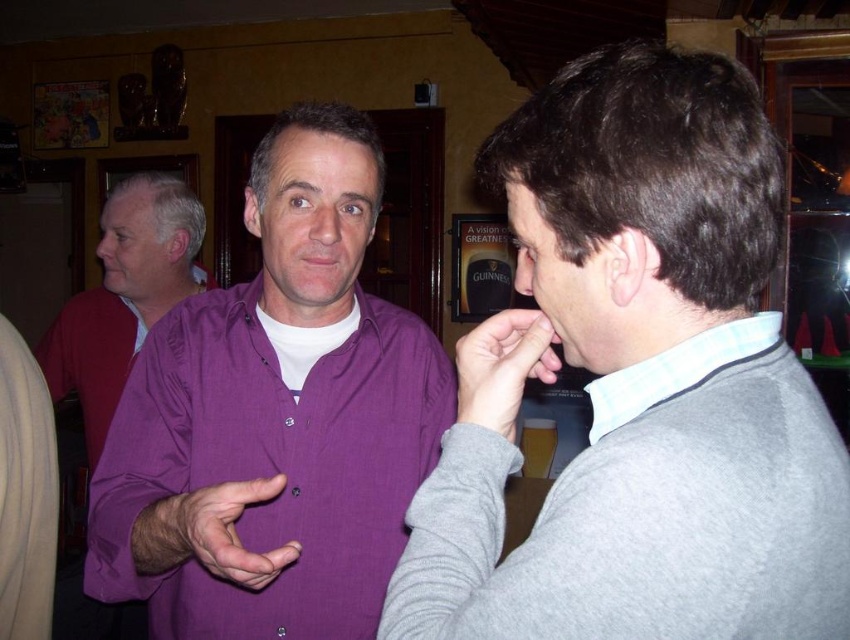
You are a photographer standing in the pub scene. You want to take a closeup photo of the purple cotton shirt at center without getting too close. Considering the distance between you and the shirt, what is the minimum focal length lens you should use if your camera sensor is 36mm wide?

The minimum focal length lens required would be calculated using the formula focal length equals sensor width multiplied by distance divided by subject width. However, since the subject width isn not provided, we can only state that the distance between the photographer and the purple cotton shirt at center is 26.17 inches. Without knowing the shirt s actual width, an exact focal length cannot be determined.

You are a fashion designer observing two purple shirts in the image. The purple cotton shirt at center and the purple satin shirt at center. Which one is bigger in size?

The purple cotton shirt at center is larger in size than the purple satin shirt at center.

You are a photographer at the pub and want to capture a group photo of the two men wearing the purple cotton shirt at center and the white textured shirt at center. Since you want to ensure both shirts are clearly visible, which shirt should you focus on first to account for their sizes?

The purple cotton shirt at center is larger in size than the white textured shirt at center, so you should focus on the purple cotton shirt at center first to ensure its details are captured clearly before adjusting for the smaller white textured shirt at center.